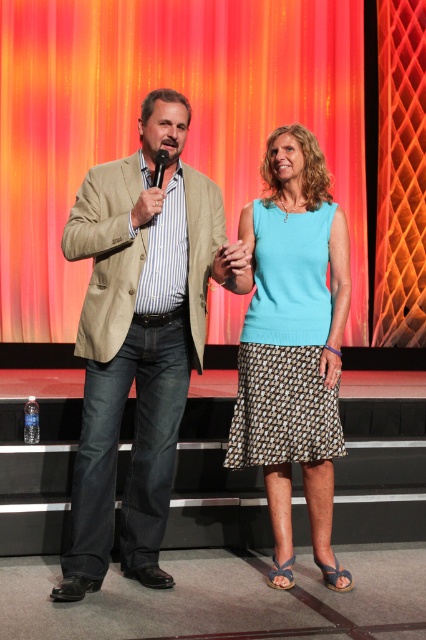
Question: Is beige textured blazer at center below black plastic microphone at upper center?

Choices:
 (A) no
 (B) yes

Answer: (B)

Question: Which of the following is the farthest from the observer?

Choices:
 (A) (316, 262)
 (B) (108, 464)
 (C) (2, 22)
 (D) (157, 180)

Answer: (C)

Question: Which point is closer to the camera?

Choices:
 (A) orange fabric curtain at upper center
 (B) black plastic microphone at upper center
 (C) beige textured blazer at center

Answer: (B)

Question: Which point is farther to the camera?

Choices:
 (A) light blue fabric skirt at center
 (B) black plastic microphone at upper center

Answer: (A)

Question: Is orange fabric curtain at upper center thinner than black plastic microphone at upper center?

Choices:
 (A) no
 (B) yes

Answer: (A)

Question: Does beige textured blazer at center have a larger size compared to black plastic microphone at upper center?

Choices:
 (A) yes
 (B) no

Answer: (A)